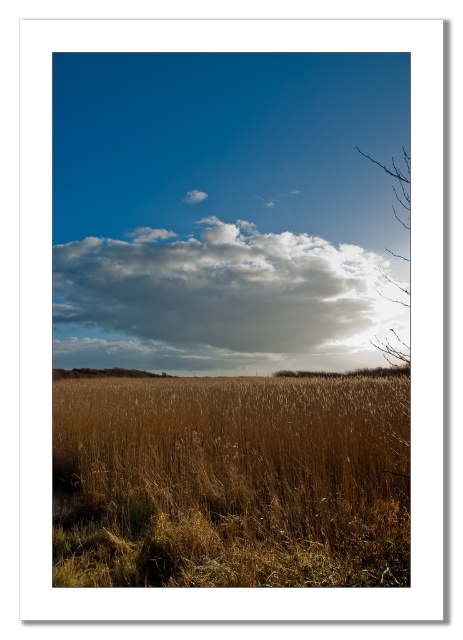
You are standing in the middle of the golden grasses and looking towards the horizon. There is a point marked at coordinates (217,300). What object is located at that point?

The cloudy white cloud at upper center is located at point (217,300).

You are standing in the middle of the brown grassy field at center and want to walk towards the brown textured tree at lower right. Which direction should you face to head directly towards the tree?

You should face towards the lower right direction to head directly towards the brown textured tree at lower right since it is located at the lower right of the scene.